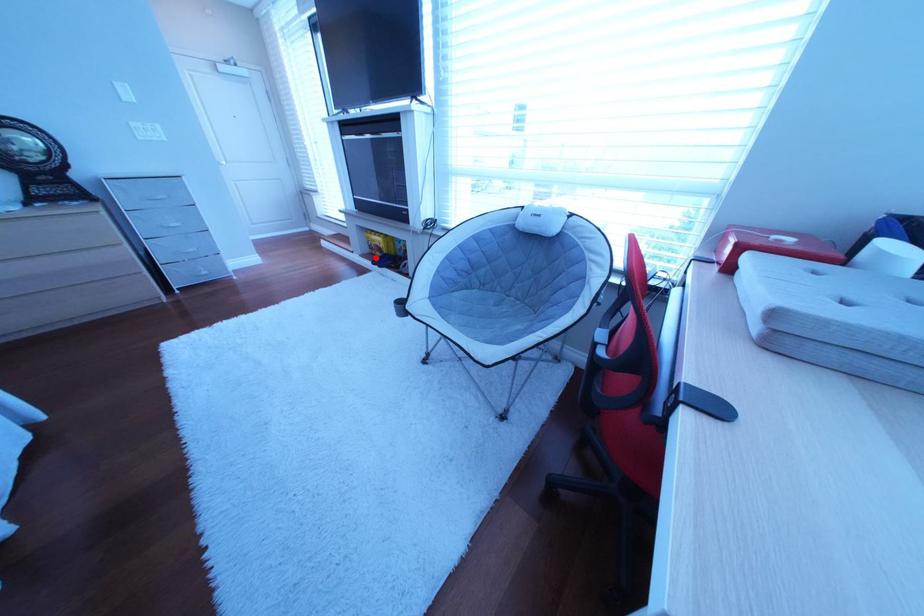
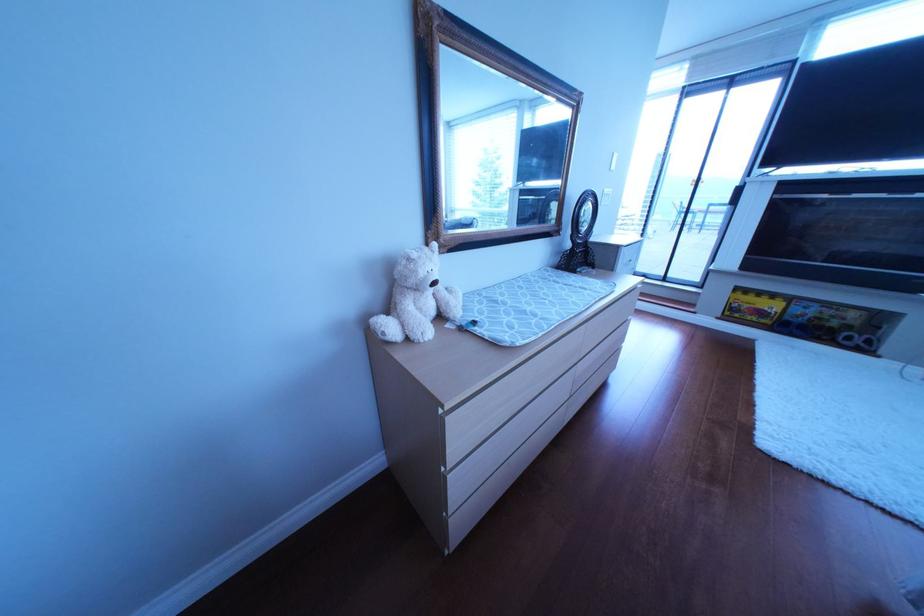
Where in the second image is the point corresponding to the highlighted location from the first image?

(733, 320)